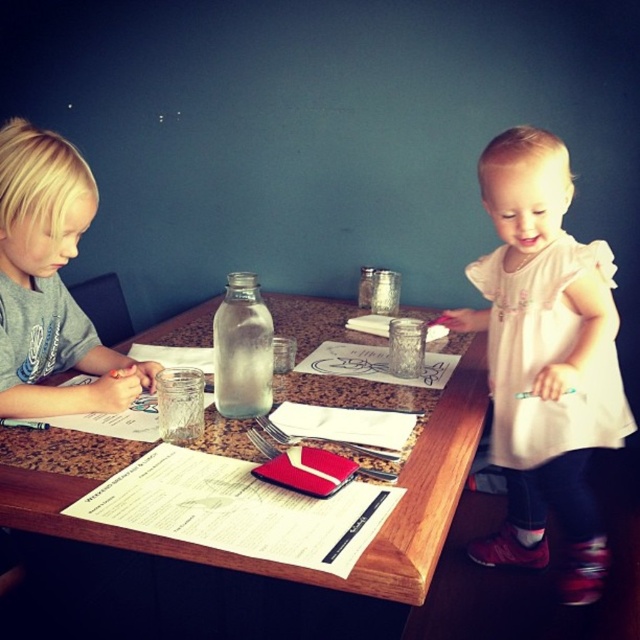
Question: From the image, what is the correct spatial relationship of brown wood table at center in relation to transparent glass bottle at center?

Choices:
 (A) above
 (B) below

Answer: (B)

Question: Based on their relative distances, which object is nearer to the white cotton dress at upper right?

Choices:
 (A) transparent glass bottle at center
 (B) smooth gray shirt at left
 (C) brown wood table at center

Answer: (C)

Question: Can you confirm if white cotton dress at upper right is positioned above brown wood table at center?

Choices:
 (A) no
 (B) yes

Answer: (A)

Question: Which point appears farthest from the camera in this image?

Choices:
 (A) (390, 547)
 (B) (17, 209)

Answer: (B)

Question: Does white cotton dress at upper right have a larger size compared to brown wood table at center?

Choices:
 (A) no
 (B) yes

Answer: (A)

Question: Which object is farther from the camera taking this photo?

Choices:
 (A) white cotton dress at upper right
 (B) smooth gray shirt at left
 (C) brown wood table at center
 (D) transparent glass bottle at center

Answer: (A)